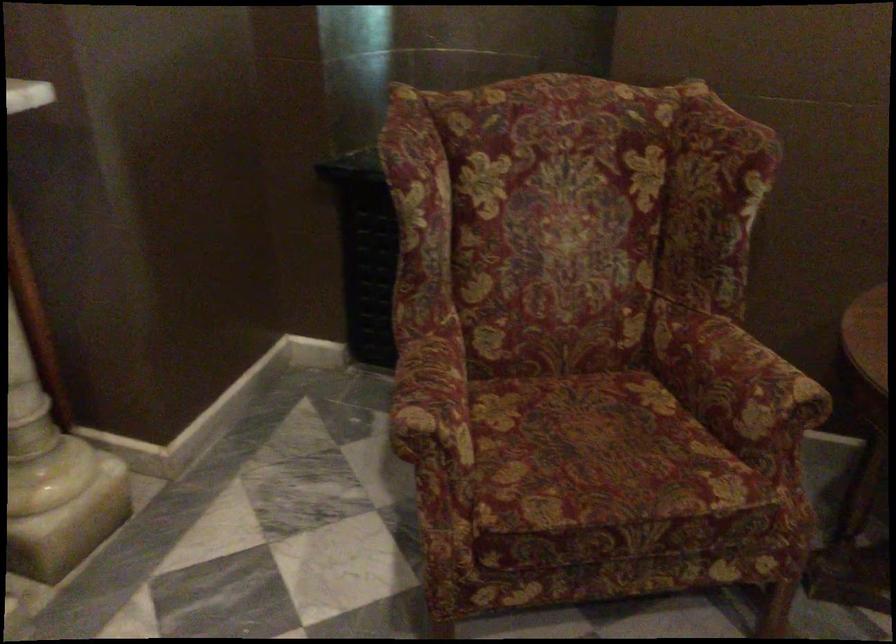
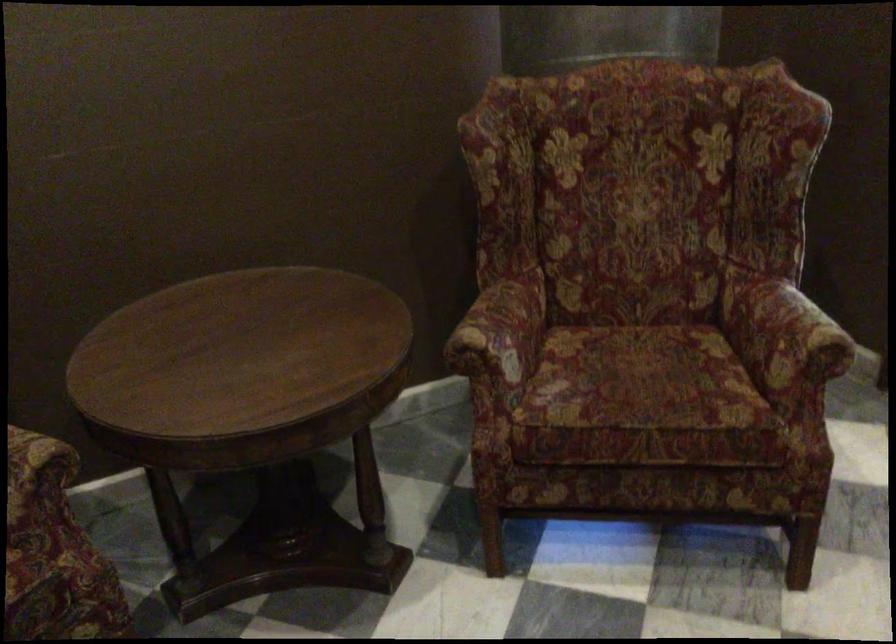
Question: The first image is from the beginning of the video and the second image is from the end. How did the camera likely rotate when shooting the video?

Choices:
 (A) Left
 (B) Right
 (C) Up
 (D) Down

Answer: (B)